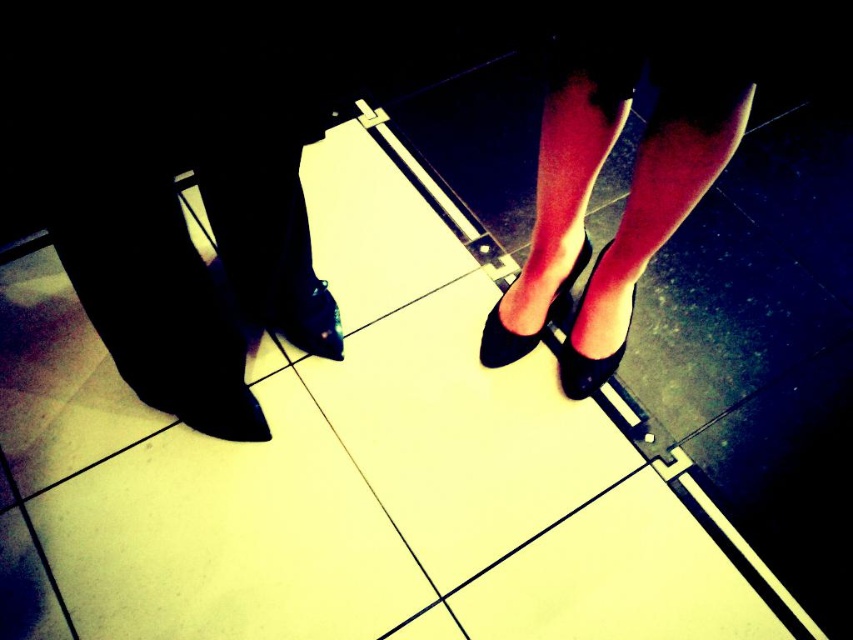
Question: Does matte black heels at upper center appear over shiny black shoe at center?

Choices:
 (A) no
 (B) yes

Answer: (B)

Question: Considering the real-world distances, which object is closest to the matte black shoe at center?

Choices:
 (A) shiny black shoe at center
 (B) shiny black high-heeled shoe at center

Answer: (B)

Question: Which object is the farthest from the shiny black shoe at center?

Choices:
 (A) matte black shoe at center
 (B) matte black heels at upper center
 (C) shiny black high-heeled shoe at center

Answer: (B)

Question: Is the position of shiny black shoe at center less distant than that of shiny black high-heeled shoe at center?

Choices:
 (A) yes
 (B) no

Answer: (A)

Question: Which of the following is the closest to the observer?

Choices:
 (A) shiny black high-heeled shoe at center
 (B) matte black heels at upper center
 (C) shiny black shoe at center

Answer: (B)

Question: Does shiny black high-heeled shoe at center appear on the left side of matte black shoe at center?

Choices:
 (A) yes
 (B) no

Answer: (B)